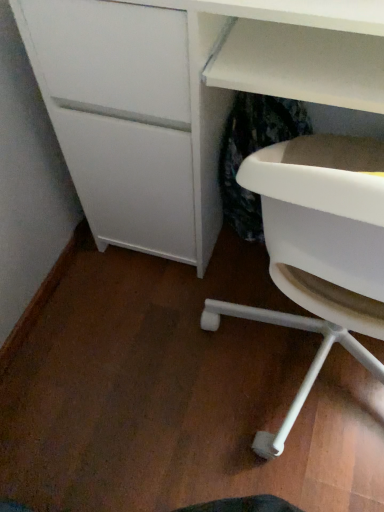
Question: Would you say white matte chair at lower right is to the left or to the right of white matte desk at center in the picture?

Choices:
 (A) left
 (B) right

Answer: (B)

Question: Looking at the image, does white matte chair at lower right seem bigger or smaller compared to white matte desk at center?

Choices:
 (A) small
 (B) big

Answer: (A)

Question: From a real-world perspective, is white matte chair at lower right positioned above or below white matte desk at center?

Choices:
 (A) above
 (B) below

Answer: (A)

Question: Looking at their shapes, would you say white matte desk at center is wider or thinner than white matte chair at lower right?

Choices:
 (A) thin
 (B) wide

Answer: (B)

Question: Is white matte desk at center to the left or to the right of white matte chair at lower right in the image?

Choices:
 (A) right
 (B) left

Answer: (B)

Question: Does point (230, 41) appear closer or farther from the camera than point (362, 208)?

Choices:
 (A) closer
 (B) farther

Answer: (B)

Question: Considering their positions, is white matte desk at center located in front of or behind white matte chair at lower right?

Choices:
 (A) front
 (B) behind

Answer: (B)